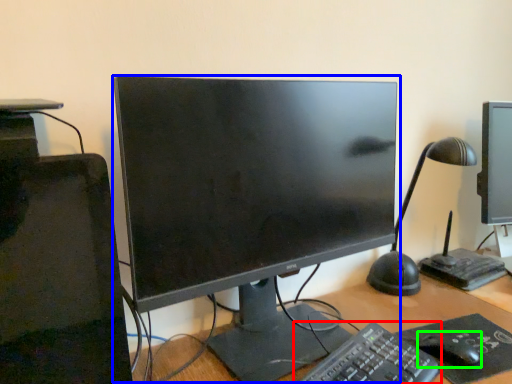
Question: Which object is positioned farthest from computer keyboard (highlighted by a red box)? Select from computer monitor (highlighted by a blue box) and mouse (highlighted by a green box).

Choices:
 (A) computer monitor
 (B) mouse

Answer: (A)